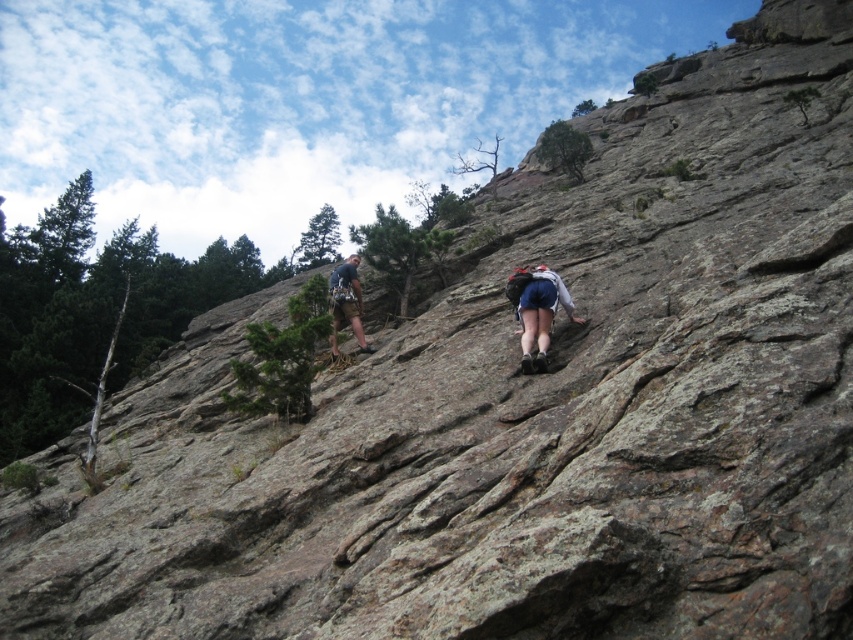
What is the color of the clothing item located at the coordinates point [537,310]?

The clothing item at point [537,310] is blue denim shorts.

You are a climber assessing your gear placement on the cliff. You notice the blue denim shorts at center and the matte gray climbing harness at center. Which item is positioned lower on your body?

The blue denim shorts at center is below matte gray climbing harness at center, so the blue denim shorts at center is positioned lower on your body.